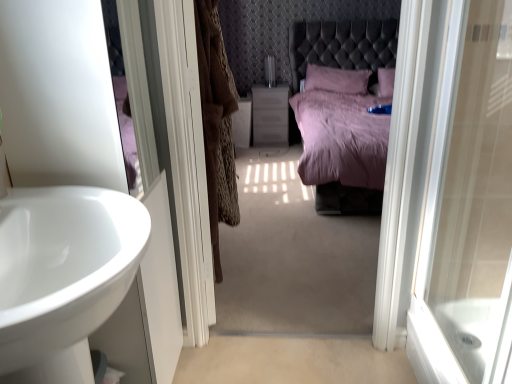
The width and height of the screenshot is (512, 384). In order to click on white glossy sink at left in this screenshot , I will do `click(64, 266)`.

Looking at this image, can you tell me how much brown fur coat at center and white glossy door at right differ in facing direction?

106 degrees separate the facing orientations of brown fur coat at center and white glossy door at right.

Considering the relative sizes of brown fur coat at center and white glossy door at right in the image provided, is brown fur coat at center thinner than white glossy door at right?

In fact, brown fur coat at center might be wider than white glossy door at right.

Find the location of `curtain above the white glossy door at right (from the image's perspective)`. curtain above the white glossy door at right (from the image's perspective) is located at coordinates pos(216,123).

Considering the positions of points (215, 155) and (467, 233), is point (215, 155) closer to camera compared to point (467, 233)?

No, it is not.

Does brown fur coat at center lie behind white glossy sink at left?

Yes, brown fur coat at center is further from the viewer.

Which is farther, [229,215] or [56,331]?

The point [229,215] is farther from the camera.

From the picture: Is brown fur coat at center bigger or smaller than white glossy sink at left?

In the image, brown fur coat at center appears to be larger than white glossy sink at left.

Can white glossy sink at left be found inside brown fur coat at center?

No.

How different are the orientations of white glossy screen door at center and white glossy door at right in degrees?

The angular difference between white glossy screen door at center and white glossy door at right is 154 degrees.

Is white glossy screen door at center closer to camera compared to white glossy door at right?

No, white glossy screen door at center is further to the viewer.

Is white glossy screen door at center inside the boundaries of white glossy door at right, or outside?

white glossy screen door at center cannot be found inside white glossy door at right.

Is brown fur coat at center wider or thinner than matte plastic vanity at center?

Considering their sizes, brown fur coat at center looks broader than matte plastic vanity at center.

Which is further, (222, 126) or (255, 95)?

The point (255, 95) is farther from the camera.

Does brown fur coat at center have a larger size compared to matte plastic vanity at center?

Indeed, brown fur coat at center has a larger size compared to matte plastic vanity at center.

Based on the photo, from the image's perspective, is brown fur coat at center over matte plastic vanity at center?

No.

Does point (435, 376) come behind point (275, 112)?

No, it is in front of (275, 112).

From the image's perspective, is white glossy door at right beneath matte plastic vanity at center?

Indeed, from the image's perspective, white glossy door at right is shown beneath matte plastic vanity at center.

In the scene shown: Is the depth of white glossy door at right greater than that of matte plastic vanity at center?

That is False.

Is brown fur coat at center aimed at white glossy screen door at center?

No, brown fur coat at center is not oriented towards white glossy screen door at center.

Considering the relative sizes of brown fur coat at center and white glossy screen door at center in the image provided, is brown fur coat at center taller than white glossy screen door at center?

No, brown fur coat at center is not taller than white glossy screen door at center.

Where is `screen door that appears on the left of brown fur coat at center`? The image size is (512, 384). screen door that appears on the left of brown fur coat at center is located at coordinates (187, 163).

Is brown fur coat at center next to white glossy screen door at center and touching it?

No, brown fur coat at center is not in contact with white glossy screen door at center.

Considering the relative sizes of matte plastic vanity at center and white glossy door at right in the image provided, is matte plastic vanity at center bigger than white glossy door at right?

Incorrect, matte plastic vanity at center is not larger than white glossy door at right.

From a real-world perspective, is matte plastic vanity at center positioned over white glossy door at right based on gravity?

Incorrect, from a real-world perspective, matte plastic vanity at center is lower than white glossy door at right.

Relative to white glossy door at right, is matte plastic vanity at center in front or behind?

In the image, matte plastic vanity at center appears behind white glossy door at right.

Could you tell me if matte plastic vanity at center is turned towards white glossy door at right?

Yes, matte plastic vanity at center is turned towards white glossy door at right.

At what (x,y) coordinates should I click in order to perform the action: click on door below the brown fur coat at center (from a real-world perspective). Please return your answer as a coordinate pair (x, y). The width and height of the screenshot is (512, 384). Looking at the image, I should click on (468, 208).

Locate an element on the screen. curtain that appears behind the white glossy sink at left is located at coordinates (216, 123).

Looking at this image, considering their positions, is matte plastic vanity at center positioned closer to white glossy screen door at center than white glossy sink at left?

white glossy sink at left is closer to white glossy screen door at center.

Based on their spatial positions, is white glossy sink at left or matte plastic vanity at center closer to white glossy door at right?

Among the two, white glossy sink at left is located nearer to white glossy door at right.

Which object lies nearer to the anchor point brown fur coat at center, white glossy screen door at center or matte plastic vanity at center?

white glossy screen door at center lies closer to brown fur coat at center than the other object.

Which object lies further to the anchor point brown fur coat at center, matte plastic vanity at center or white glossy screen door at center?

matte plastic vanity at center is positioned further to the anchor brown fur coat at center.

Based on their spatial positions, is brown fur coat at center or white glossy door at right further from white glossy sink at left?

Based on the image, white glossy door at right appears to be further to white glossy sink at left.

From the image, which object appears to be farther from matte plastic vanity at center, white glossy door at right or brown fur coat at center?

white glossy door at right is further to matte plastic vanity at center.

Based on their spatial positions, is white glossy screen door at center or white glossy door at right further from white glossy sink at left?

The object further to white glossy sink at left is white glossy door at right.

When comparing their distances from white glossy screen door at center, does white glossy sink at left or white glossy door at right seem further?

Among the two, white glossy door at right is located further to white glossy screen door at center.

At what (x,y) coordinates should I click in order to perform the action: click on screen door positioned between white glossy door at right and brown fur coat at center from near to far. Please return your answer as a coordinate pair (x, y). Looking at the image, I should click on click(187, 163).

Where is `screen door between white glossy door at right and matte plastic vanity at center from front to back`? The image size is (512, 384). screen door between white glossy door at right and matte plastic vanity at center from front to back is located at coordinates (187, 163).

Where is `curtain between white glossy door at right and matte plastic vanity at center along the z-axis`? The height and width of the screenshot is (384, 512). curtain between white glossy door at right and matte plastic vanity at center along the z-axis is located at coordinates point(216,123).

The width and height of the screenshot is (512, 384). Find the location of `screen door located between white glossy sink at left and brown fur coat at center in the depth direction`. screen door located between white glossy sink at left and brown fur coat at center in the depth direction is located at coordinates (187, 163).